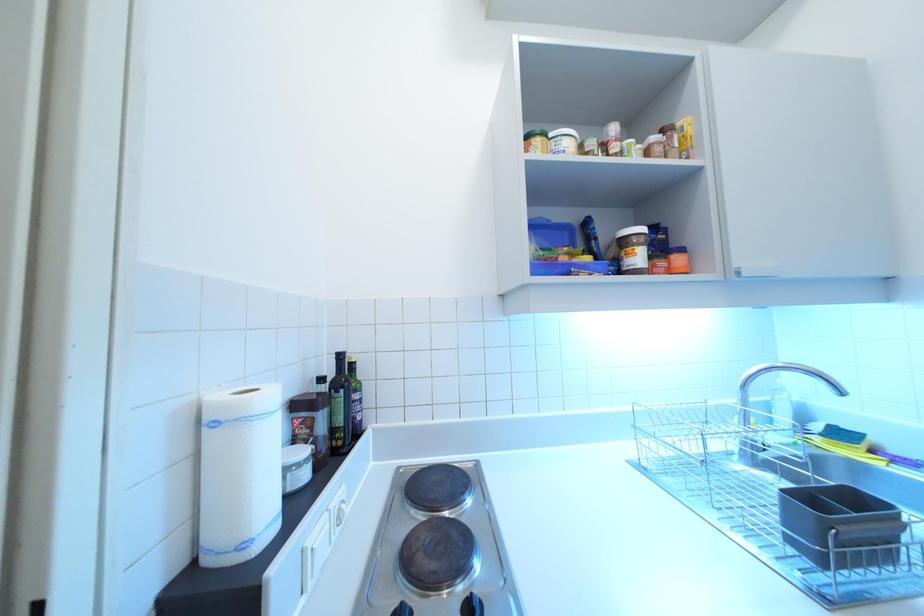
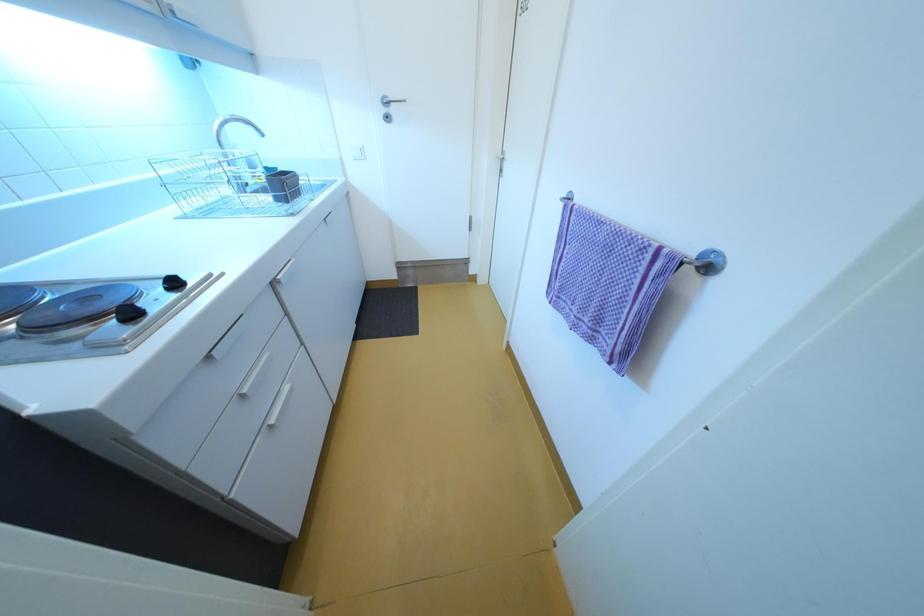
How did the camera likely rotate?

The camera rotated toward right-down.